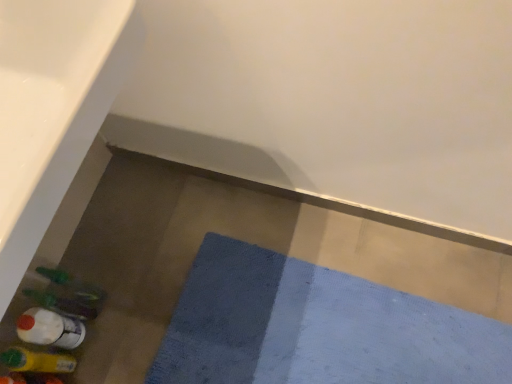
Where is `free point below blue textured bath mat at lower center (from a real-world perspective)`? Image resolution: width=512 pixels, height=384 pixels. free point below blue textured bath mat at lower center (from a real-world perspective) is located at coordinates (325, 336).